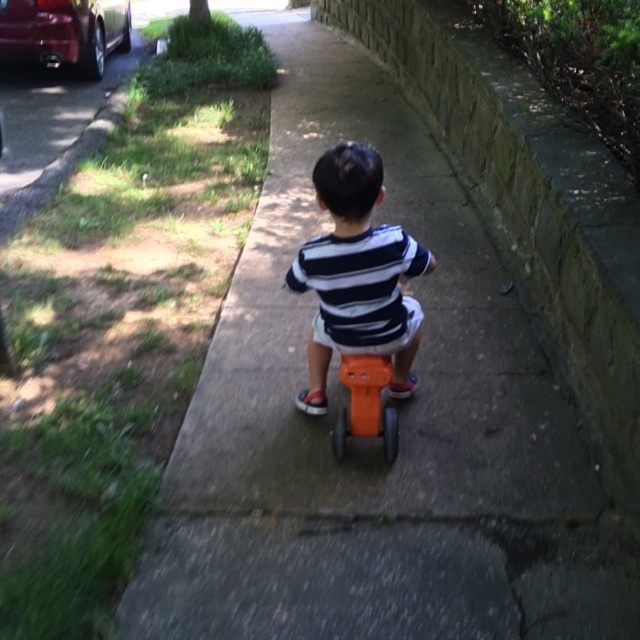
You are a parent trying to ensure your child stays safe while riding their orange plastic toy at center. The metallic red car at upper left is parked nearby. Based on the size difference between the two, which object might pose a greater risk of collision if the child moves towards the car?

The metallic red car at upper left is larger in size than the orange plastic toy at center, so it might pose a greater risk of collision due to its larger size and potential for more severe impact.

You are a parent trying to ensure your child stays safe while riding their orange plastic toy at center on the sidewalk. The metallic red car at upper left is parked nearby. Which object is taller, and why does that matter for safety?

The metallic red car at upper left is taller than the orange plastic toy at center. This matters for safety because the car is taller, making it harder for the child on the toy to see around it, potentially creating blind spots.

You are a delivery robot that needs to navigate to the matte orange plastic tricycle at center. You are currently near the metallic red car at upper left. Which direction should you move to reach the tricycle?

The matte orange plastic tricycle at center is positioned on the right side of the metallic red car at upper left. Therefore, you should move to the right to reach the matte orange plastic tricycle at center from the metallic red car at upper left.